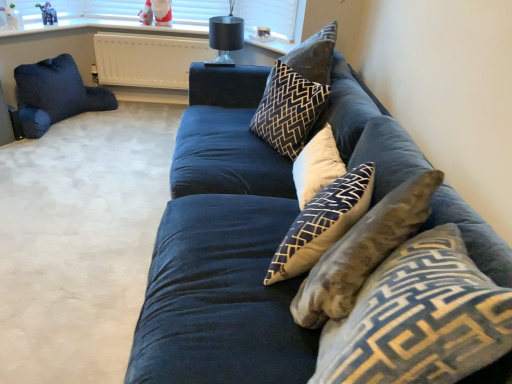
At what (x,y) coordinates should I click in order to perform the action: click on free space on the front side of dark blue velvet pillow at left, which is the 5th pillow from right to left. Please return your answer as a coordinate pair (x, y). Looking at the image, I should click on (56, 152).